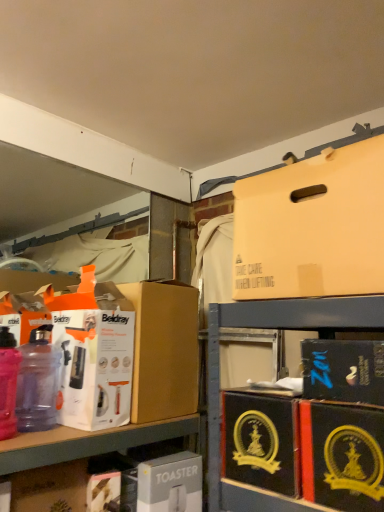
Question: Is matte cardboard box at upper right, which is the 6th box from bottom to top, taller than matte cardboard box at lower left?

Choices:
 (A) no
 (B) yes

Answer: (B)

Question: Can you confirm if matte cardboard box at upper right, which is counted as the first box, starting from the top, is wider than matte cardboard box at lower left?

Choices:
 (A) yes
 (B) no

Answer: (A)

Question: From a real-world perspective, is matte cardboard box at upper right, which is counted as the first box, starting from the top, on matte cardboard box at lower left?

Choices:
 (A) yes
 (B) no

Answer: (A)

Question: From the image's perspective, is matte cardboard box at upper right, which is counted as the first box, starting from the top, beneath matte cardboard box at lower left?

Choices:
 (A) no
 (B) yes

Answer: (A)

Question: Does matte cardboard box at upper right, which is counted as the first box, starting from the top, turn towards matte cardboard box at lower left?

Choices:
 (A) yes
 (B) no

Answer: (B)

Question: Would you say black cardboard box at lower right, which is counted as the 4th box, starting from the top, is to the left or to the right of matte cardboard box at lower left in the picture?

Choices:
 (A) right
 (B) left

Answer: (A)

Question: Relative to matte cardboard box at lower left, is black cardboard box at lower right, the 3th box when ordered from bottom to top, in front or behind?

Choices:
 (A) behind
 (B) front

Answer: (B)

Question: Is black cardboard box at lower right, which is counted as the 4th box, starting from the top, taller or shorter than matte cardboard box at lower left?

Choices:
 (A) tall
 (B) short

Answer: (B)

Question: From a real-world perspective, is black cardboard box at lower right, the 3th box when ordered from bottom to top, above or below matte cardboard box at lower left?

Choices:
 (A) above
 (B) below

Answer: (A)

Question: Is matte cardboard box at lower left situated inside matte black box at lower right, the 2th box positioned from the top, or outside?

Choices:
 (A) outside
 (B) inside

Answer: (A)

Question: Based on their positions, is matte cardboard box at lower left located to the left or right of matte black box at lower right, the 2th box positioned from the top?

Choices:
 (A) left
 (B) right

Answer: (A)

Question: Looking at their shapes, would you say matte cardboard box at lower left is wider or thinner than matte black box at lower right, the 2th box positioned from the top?

Choices:
 (A) wide
 (B) thin

Answer: (A)

Question: From a real-world perspective, is matte cardboard box at lower left positioned above or below matte black box at lower right, acting as the fifth box starting from the bottom?

Choices:
 (A) below
 (B) above

Answer: (A)

Question: Looking at the image, does translucent plastic bottle at left, the 1th bottle from the left, seem bigger or smaller compared to black cardboard box at lower right, the second box ordered from the bottom?

Choices:
 (A) big
 (B) small

Answer: (B)

Question: Would you say translucent plastic bottle at left, the 1th bottle from the left, is to the left or to the right of black cardboard box at lower right, the fifth box in the top-to-bottom sequence, in the picture?

Choices:
 (A) left
 (B) right

Answer: (A)